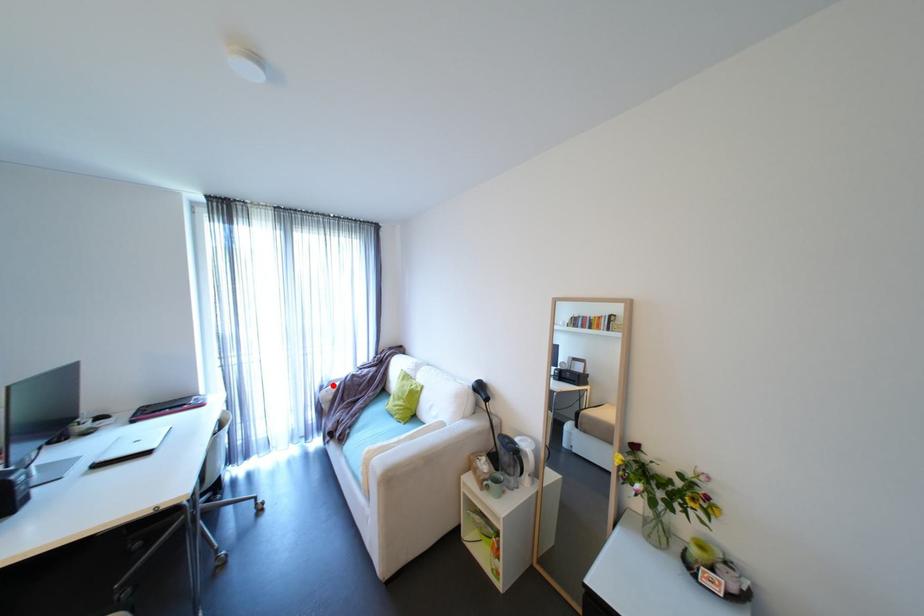
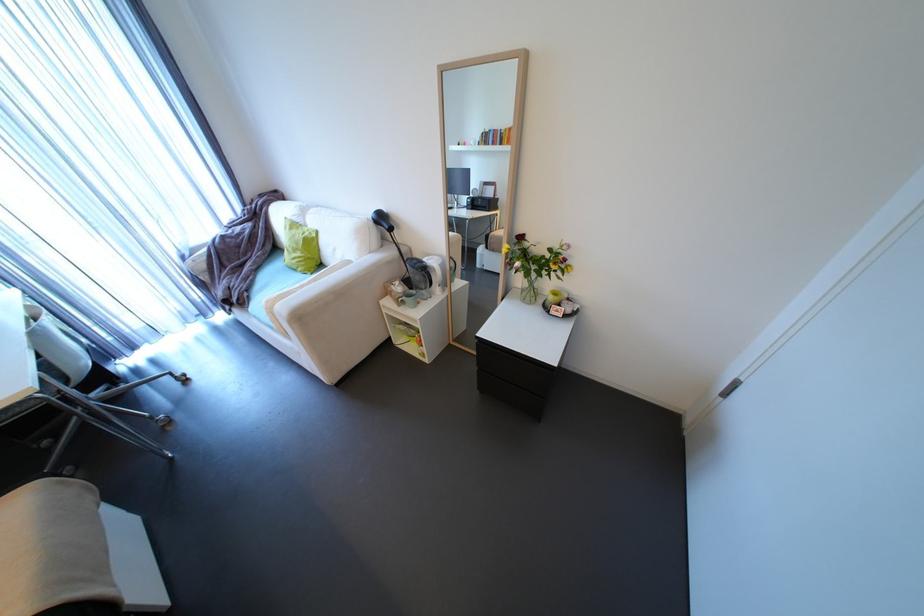
In the second image, find the point that corresponds to the highlighted location in the first image.

(195, 254)